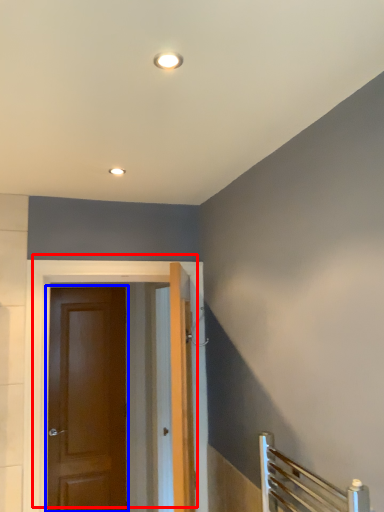
Question: Which object appears farthest to the camera in this image, door (highlighted by a red box) or door (highlighted by a blue box)?

Choices:
 (A) door
 (B) door

Answer: (B)